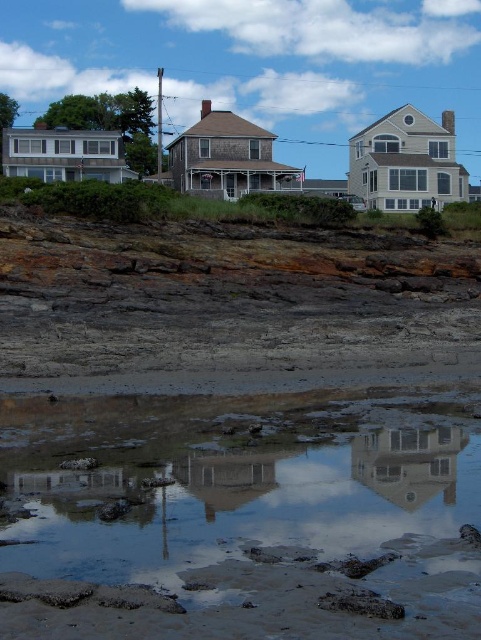
Question: Which of the following is the farthest from the observer?

Choices:
 (A) (443, 465)
 (B) (76, 577)

Answer: (A)

Question: Among these objects, which one is farthest from the camera?

Choices:
 (A) white glossy house at center
 (B) clear water at lower center

Answer: (A)

Question: Does clear water at lower center lie behind white glossy house at center?

Choices:
 (A) yes
 (B) no

Answer: (B)

Question: Is clear water at lower center further to the viewer compared to white glossy house at center?

Choices:
 (A) no
 (B) yes

Answer: (A)

Question: Does clear water at lower center appear under white glossy house at center?

Choices:
 (A) no
 (B) yes

Answer: (B)